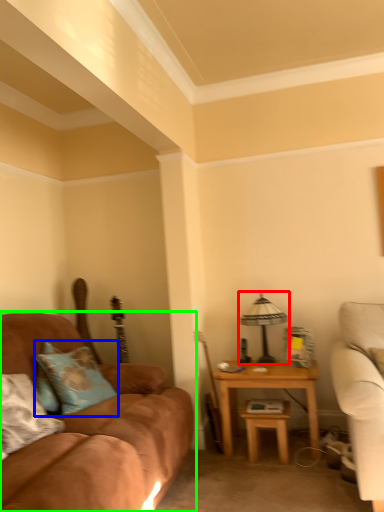
Question: Considering the real-world distances, which object is closest to table lamp (highlighted by a red box)? pillow (highlighted by a blue box) or studio couch (highlighted by a green box).

Choices:
 (A) pillow
 (B) studio couch

Answer: (B)